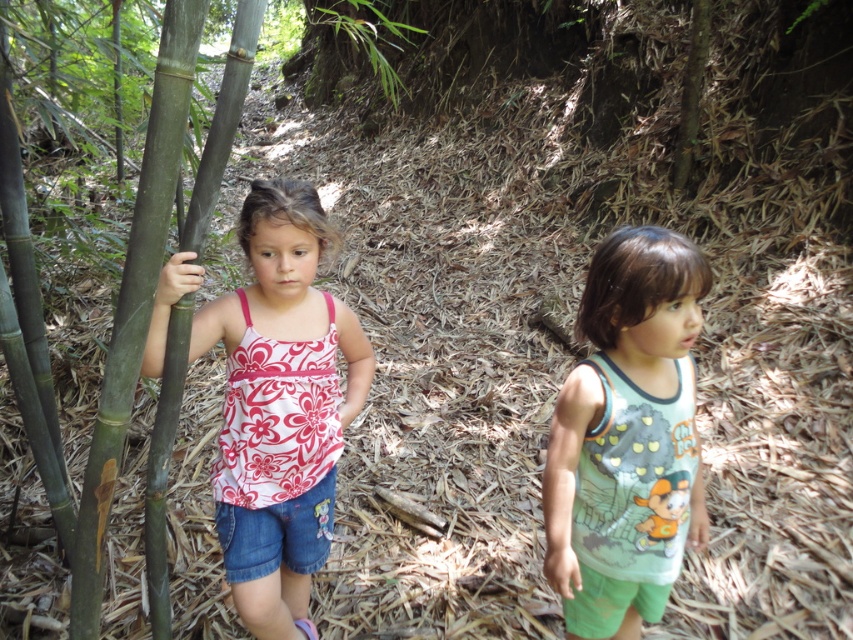
Does floral-patterned tank top at left appear on the right side of green smooth bamboo at left?

Yes, floral-patterned tank top at left is to the right of green smooth bamboo at left.

Who is more forward, (252,241) or (206,173)?

Point (206,173) is more forward.

Which is behind, point (245, 394) or point (207, 202)?

Positioned behind is point (245, 394).

At what (x,y) coordinates should I click in order to perform the action: click on floral-patterned tank top at left. Please return your answer as a coordinate pair (x, y). Looking at the image, I should click on (280, 406).

From the picture: Can you confirm if green cotton tank top at center is bigger than green smooth bamboo at left?

Actually, green cotton tank top at center might be smaller than green smooth bamboo at left.

Is green cotton tank top at center thinner than green smooth bamboo at left?

Incorrect, green cotton tank top at center's width is not less than green smooth bamboo at left's.

Is point (550, 486) in front of point (166, 630)?

Yes, point (550, 486) is in front of point (166, 630).

Where is `green cotton tank top at center`? green cotton tank top at center is located at coordinates (627, 436).

Between floral-patterned tank top at left and green cotton tank top at center, which one has less height?

green cotton tank top at center is shorter.

Image resolution: width=853 pixels, height=640 pixels. What do you see at coordinates (280, 406) in the screenshot?
I see `floral-patterned tank top at left` at bounding box center [280, 406].

Image resolution: width=853 pixels, height=640 pixels. Identify the location of floral-patterned tank top at left. (x=280, y=406).